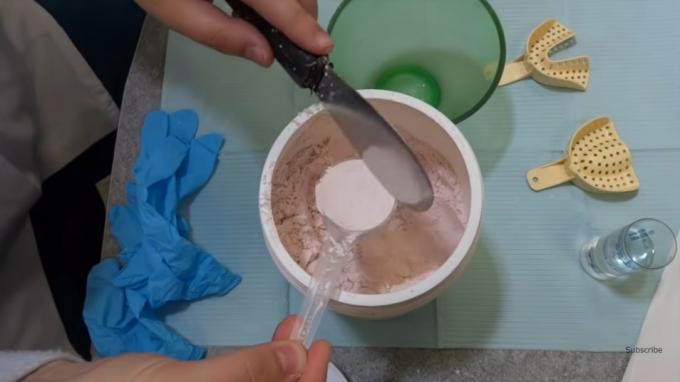
Find the location of a particular element. This screenshot has height=382, width=680. bowl is located at coordinates (474, 100).